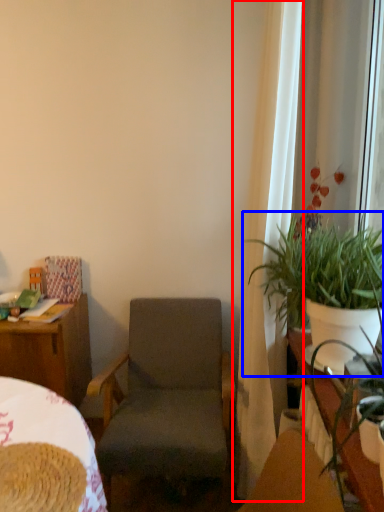
Question: Among these objects, which one is nearest to the camera, curtain (highlighted by a red box) or houseplant (highlighted by a blue box)?

Choices:
 (A) curtain
 (B) houseplant

Answer: (B)